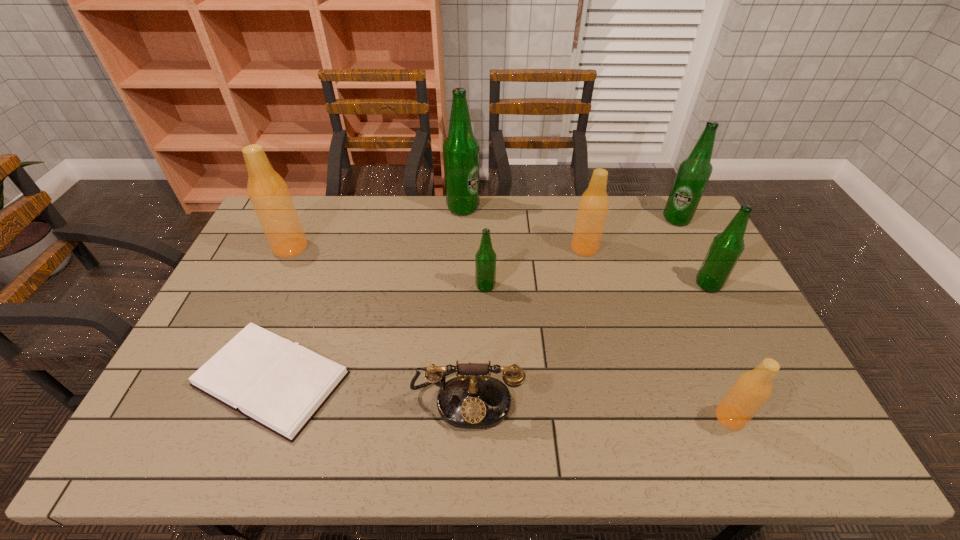
Find the location of `the tallest beer bottle`. the tallest beer bottle is located at coordinates click(460, 149).

Where is `the biggest green beer bottle`? This screenshot has width=960, height=540. the biggest green beer bottle is located at coordinates (460, 149).

Locate an element on the screen. The image size is (960, 540). the third smallest green beer bottle is located at coordinates (693, 174).

Where is `the biggest tan beer bottle`? the biggest tan beer bottle is located at coordinates (269, 194).

Locate an element on the screen. This screenshot has width=960, height=540. the leftmost beer bottle is located at coordinates (269, 194).

What are the coordinates of `the second smallest green beer bottle` in the screenshot? It's located at (726, 248).

What are the coordinates of `the sixth object from left to right` in the screenshot? It's located at (593, 206).

Where is `the fourth beer bottle from right to left`? The width and height of the screenshot is (960, 540). the fourth beer bottle from right to left is located at coordinates (593, 206).

Image resolution: width=960 pixels, height=540 pixels. What are the coordinates of `the smallest green beer bottle` in the screenshot? It's located at (485, 259).

Locate an element on the screen. Image resolution: width=960 pixels, height=540 pixels. the rightmost tan beer bottle is located at coordinates (751, 390).